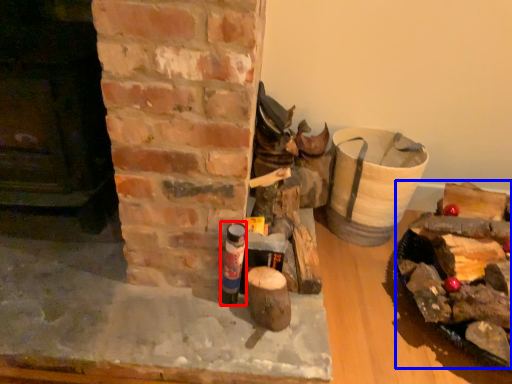
Question: Which object is closer to the camera taking this photo, bottle (highlighted by a red box) or debris (highlighted by a blue box)?

Choices:
 (A) bottle
 (B) debris

Answer: (B)